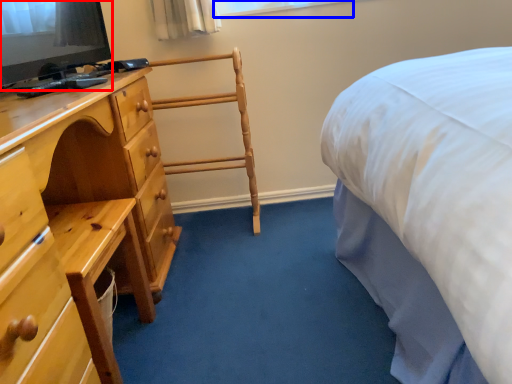
Question: Which of the following is the farthest to the observer, television (highlighted by a red box) or window (highlighted by a blue box)?

Choices:
 (A) television
 (B) window

Answer: (B)